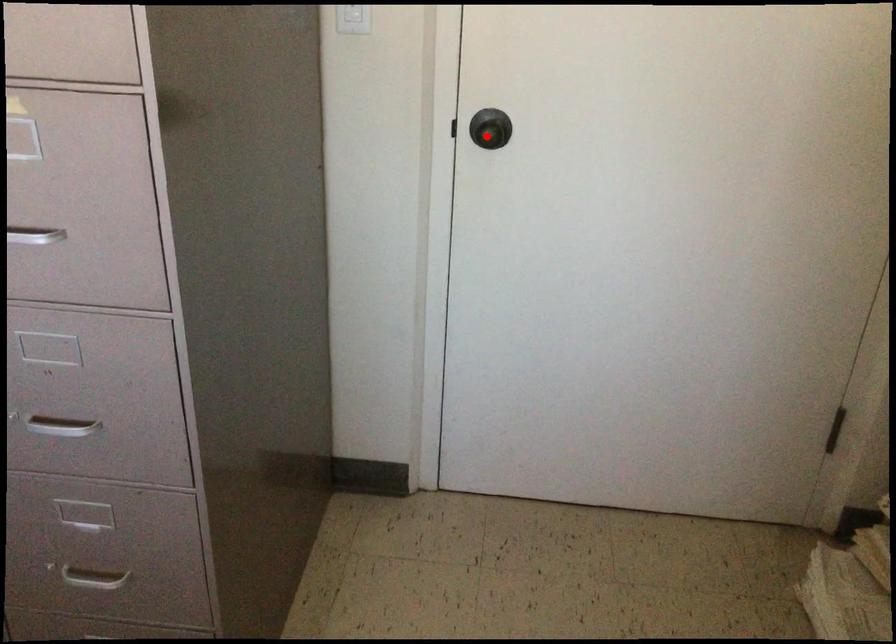
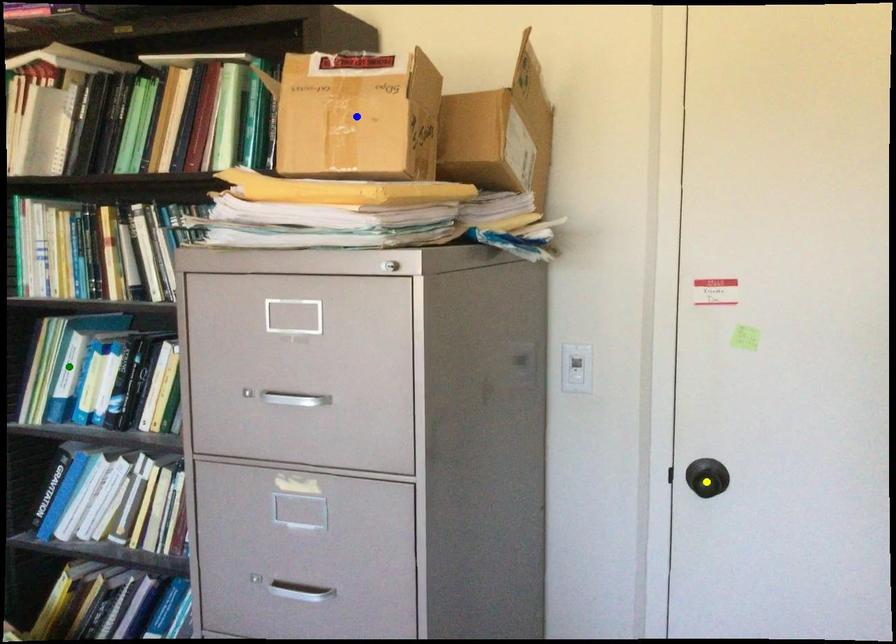
Question: I am providing you with two images of the same scene from different viewpoints. A red point is marked on the first image. You are given multiple points on the second image. Which mark in image 2 goes with the point in image 1?

Choices:
 (A) green point
 (B) blue point
 (C) yellow point

Answer: (C)